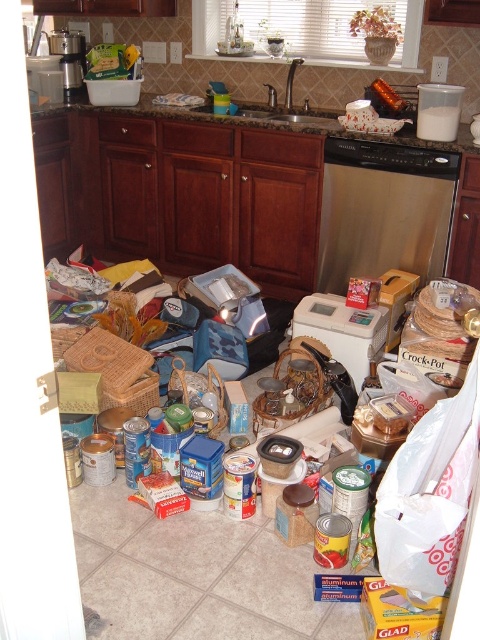
Consider the image. Between white plastic toaster at center and metallic coffee maker at upper left, which one is positioned lower?

white plastic toaster at center is lower down.

Does white plastic toaster at center appear over metallic coffee maker at upper left?

Incorrect, white plastic toaster at center is not positioned above metallic coffee maker at upper left.

Between point (362, 369) and point (73, 77), which one is positioned behind?

Point (73, 77)

I want to click on white plastic toaster at center, so click(343, 330).

Which is in front, point (184, 108) or point (348, 324)?

Point (348, 324) is more forward.

Does brown granite countertop at center have a greater height compared to white plastic toaster at center?

Correct, brown granite countertop at center is much taller as white plastic toaster at center.

Measure the distance between brown granite countertop at center and camera.

brown granite countertop at center and camera are 8.51 feet apart from each other.

You are a GUI agent. You are given a task and a screenshot of the screen. Output one action in this format:
    pyautogui.click(x=<x>, y=<y>)
    Task: Click on the brown granite countertop at center
    
    Given the screenshot: What is the action you would take?
    pyautogui.click(x=263, y=122)

Based on the photo, does brown granite countertop at center have a lesser width compared to metallic coffee maker at upper left?

In fact, brown granite countertop at center might be wider than metallic coffee maker at upper left.

Is brown granite countertop at center to the left of metallic coffee maker at upper left from the viewer's perspective?

In fact, brown granite countertop at center is to the right of metallic coffee maker at upper left.

Which is behind, point (158, 116) or point (63, 35)?

The point (63, 35) is behind.

Find the location of a particular element. This screenshot has width=480, height=640. brown granite countertop at center is located at coordinates (263, 122).